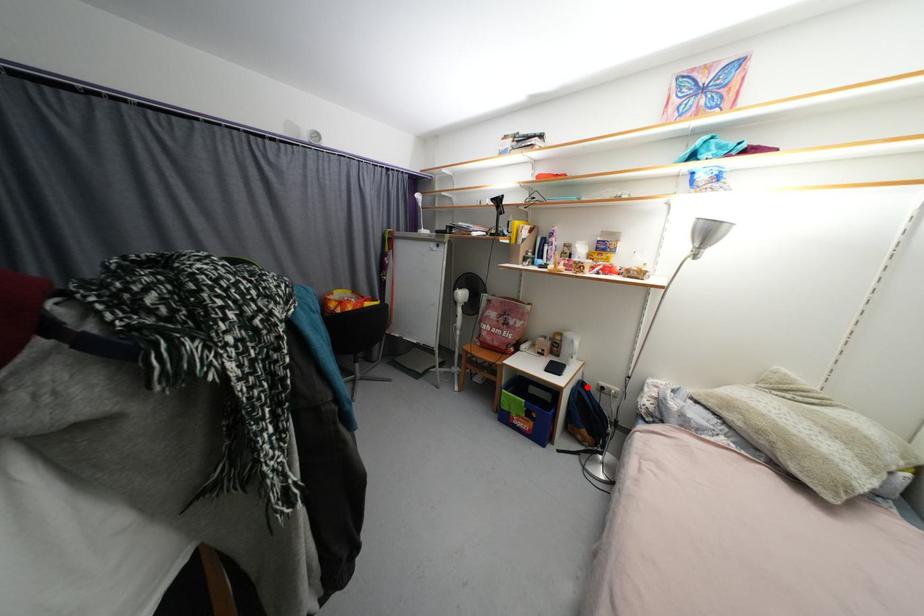
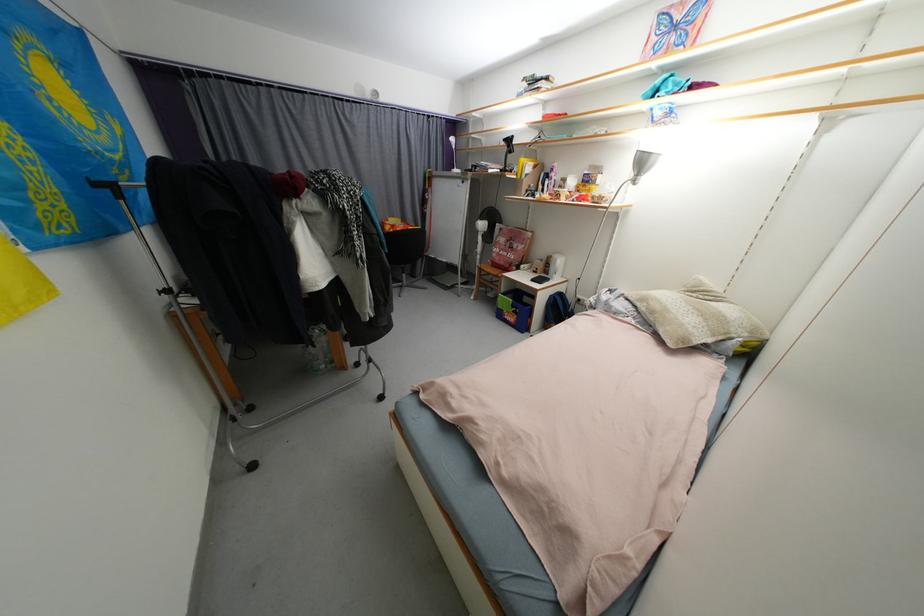
Question: A red point is marked in image1. In image2, is the corresponding 3D point closer to the camera or farther? Reply with the corresponding letter.

Choices:
 (A) The corresponding 3D point is closer.
 (B) The corresponding 3D point is farther.

Answer: (A)